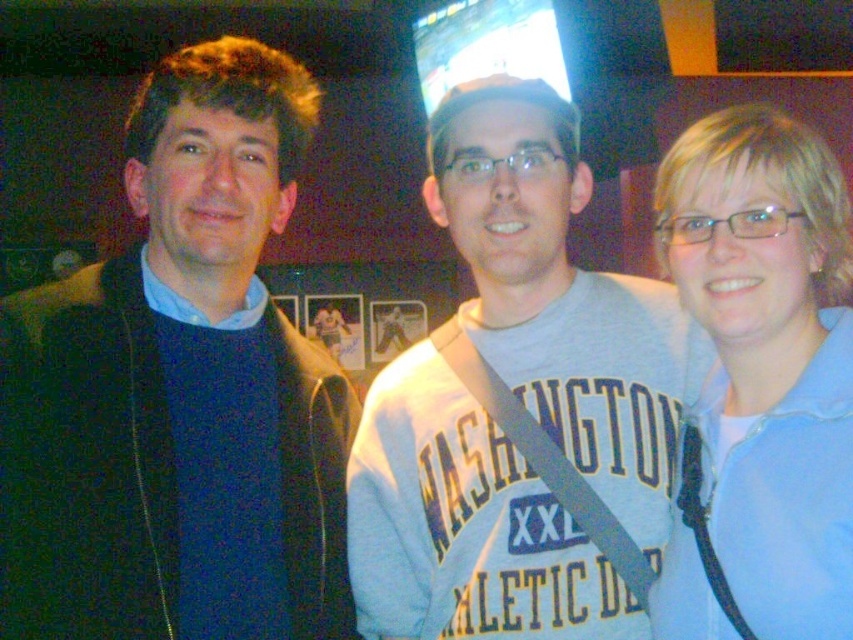
Based on the photo, you are at a social event and want to take a photo of the gray cotton sweatshirt at center and the light blue fabric at right. Which one is lower in the frame?

The gray cotton sweatshirt at center is positioned under the light blue fabric at right, so it is lower in the frame.

You are a photographer at a social event. You want to take a group photo of the gray cotton sweatshirt at center and the light blue fabric at right. The camera requires a minimum distance of 8 inches between subjects for clear focus. Can you capture both subjects in focus without moving them?

The gray cotton sweatshirt at center is 9.08 inches from the light blue fabric at right, which exceeds the minimum 8 inches required for clear focus. Therefore, the camera can capture both subjects in focus without moving them.

You are standing at the point marked by the coordinates point (27, 477) in the image. You want to move to the door located at the opposite end of the room. The door is 3 feet wide. If you walk straight towards the door, will you have enough space to pass through without touching the walls?

The distance between you and the viewer is 3.81 feet, which is wider than the door width of 3 feet. Therefore, you have enough space to pass through the door without touching the walls.